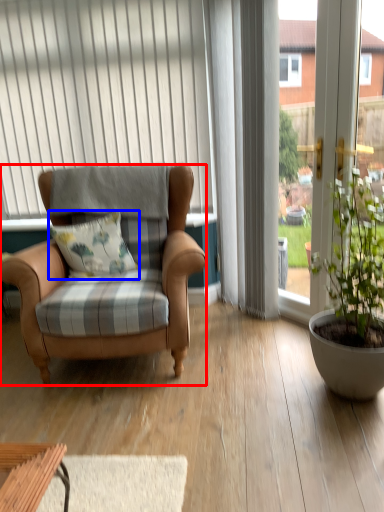
Question: Among these objects, which one is farthest to the camera, chair (highlighted by a red box) or pillow (highlighted by a blue box)?

Choices:
 (A) chair
 (B) pillow

Answer: (B)